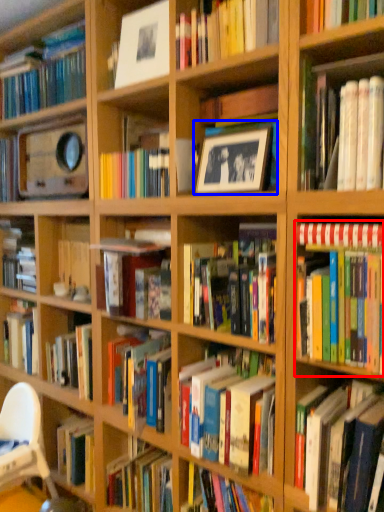
Question: Which object appears closest to the camera in this image, book (highlighted by a red box) or picture frame (highlighted by a blue box)?

Choices:
 (A) book
 (B) picture frame

Answer: (A)